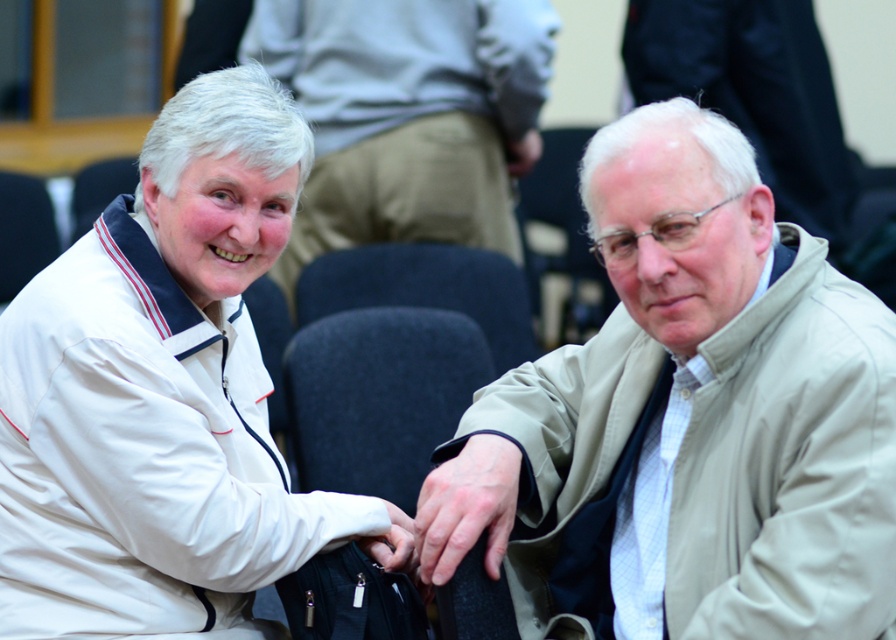
Question: Does dark gray fabric chair at center lie behind smooth beige hand at center?

Choices:
 (A) no
 (B) yes

Answer: (B)

Question: Is dark gray fabric chair at center to the left of smooth beige hand at center from the viewer's perspective?

Choices:
 (A) no
 (B) yes

Answer: (A)

Question: Estimate the real-world distances between objects in this image. Which object is farther from the beige fabric jacket at upper right?

Choices:
 (A) white matte wristband at center
 (B) beige fabric jacket at right

Answer: (B)

Question: Which point appears closest to the camera in this image?

Choices:
 (A) (511, 515)
 (B) (402, 518)

Answer: (A)

Question: Among these objects, which one is farthest from the camera?

Choices:
 (A) beige fabric jacket at upper right
 (B) smooth beige hand at center

Answer: (B)

Question: Is beige fabric jacket at right positioned before white matte wristband at center?

Choices:
 (A) no
 (B) yes

Answer: (B)